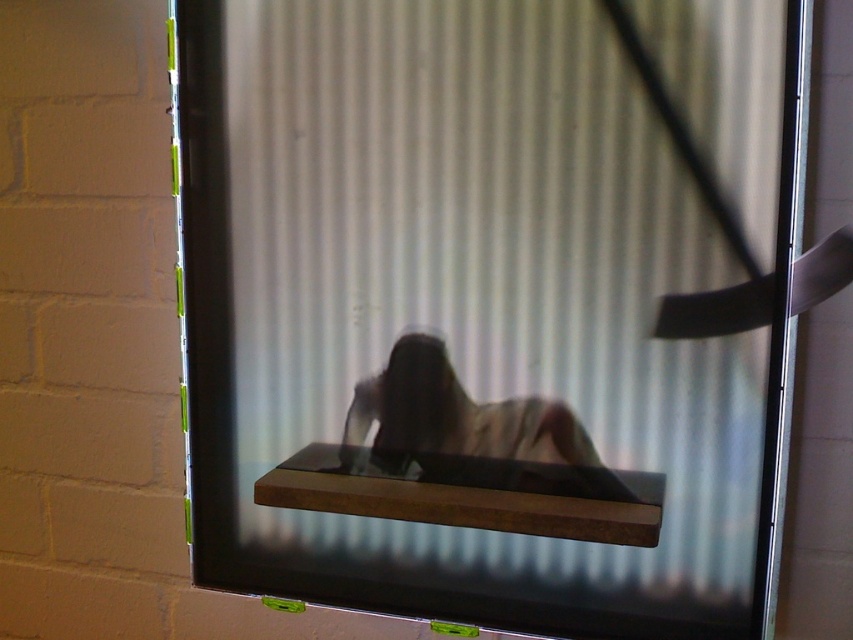
Can you confirm if brown wood at center is shorter than light beige fabric at center?

Indeed, brown wood at center has a lesser height compared to light beige fabric at center.

Between brown wood at center and light beige fabric at center, which one appears on the left side from the viewer's perspective?

brown wood at center is more to the left.

Is point (631, 516) positioned in front of point (442, 372)?

That is True.

The image size is (853, 640). Find the location of `brown wood at center`. brown wood at center is located at coordinates (473, 493).